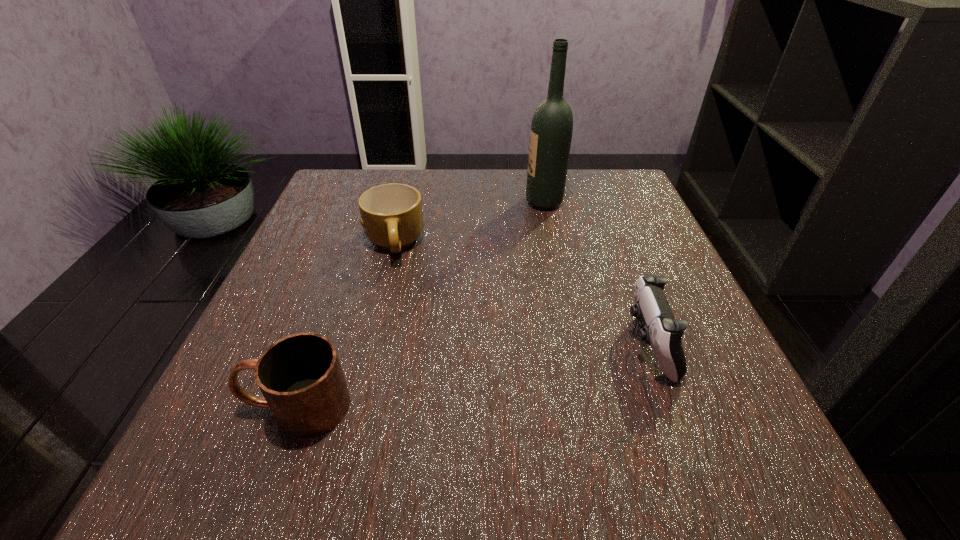
Where is `the tallest object`? the tallest object is located at coordinates (551, 131).

Locate an element on the screen. the farthest object is located at coordinates (x=551, y=131).

You are a GUI agent. You are given a task and a screenshot of the screen. Output one action in this format:
    pyautogui.click(x=<x>, y=<y>)
    Task: Click on the rightmost object
    
    Given the screenshot: What is the action you would take?
    pyautogui.click(x=661, y=330)

Find the location of a particular element. This screenshot has width=960, height=540. the nearer mug is located at coordinates (300, 376).

Locate an element on the screen. the farther mug is located at coordinates (391, 214).

Locate an element on the screen. The width and height of the screenshot is (960, 540). blank space located on the labeled side of the wine bottle is located at coordinates point(488,202).

The image size is (960, 540). I want to click on vacant space located on the labeled side of the wine bottle, so click(454, 202).

Identify the location of vacant space positioned 0.110m on the labeled side of the wine bottle. (479, 202).

At what (x,y) coordinates should I click in order to perform the action: click on free space located 0.250m on the front-facing side of the rightmost object. Please return your answer as a coordinate pair (x, y). Looking at the image, I should click on (476, 345).

What are the coordinates of `free location located 0.360m on the front-facing side of the rightmost object` in the screenshot? It's located at (410, 345).